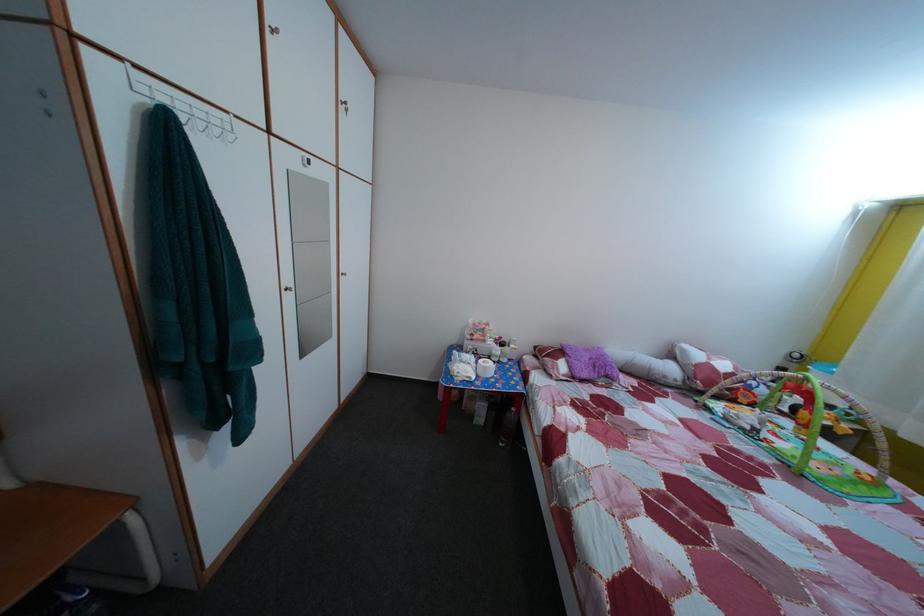
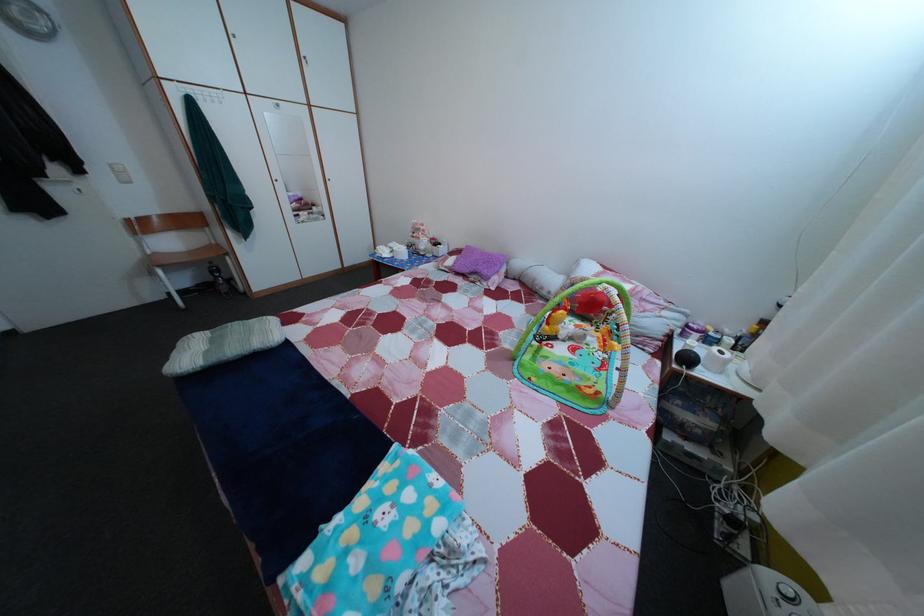
Find the pixel in the second image that matches (679,389) in the first image.

(553, 301)